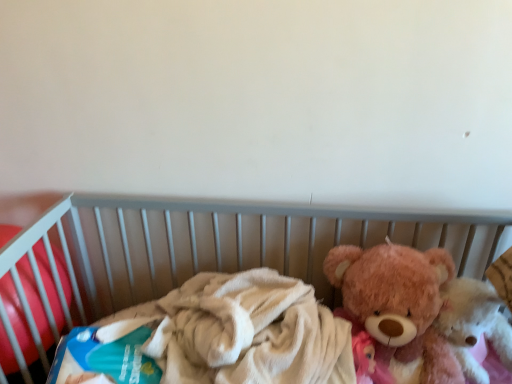
Question: Is soft plush bear at right closer to camera compared to blue cardboard box at left?

Choices:
 (A) yes
 (B) no

Answer: (A)

Question: From the image's perspective, would you say soft plush bear at right is shown under blue cardboard box at left?

Choices:
 (A) no
 (B) yes

Answer: (B)

Question: Is soft plush bear at right behind blue cardboard box at left?

Choices:
 (A) yes
 (B) no

Answer: (B)

Question: From a real-world perspective, is soft plush bear at right under blue cardboard box at left?

Choices:
 (A) no
 (B) yes

Answer: (B)

Question: From the image's perspective, would you say soft plush bear at right is positioned over blue cardboard box at left?

Choices:
 (A) no
 (B) yes

Answer: (A)

Question: From a real-world perspective, is blue cardboard box at left positioned above or below fluffy pink teddy bear at right, which ranks as the second teddy bear in left-to-right order?

Choices:
 (A) above
 (B) below

Answer: (A)

Question: Is blue cardboard box at left inside or outside of fluffy pink teddy bear at right, which is counted as the first teddy bear, starting from the right?

Choices:
 (A) inside
 (B) outside

Answer: (B)

Question: Does point tap(15, 307) appear closer or farther from the camera than point tap(496, 319)?

Choices:
 (A) farther
 (B) closer

Answer: (B)

Question: Based on their sizes in the image, would you say blue cardboard box at left is bigger or smaller than fluffy pink teddy bear at right, which ranks as the second teddy bear in left-to-right order?

Choices:
 (A) small
 (B) big

Answer: (B)

Question: Considering their positions, is fluffy pink teddy bear at right, acting as the 2th teddy bear starting from the right, located in front of or behind soft plush bear at right?

Choices:
 (A) behind
 (B) front

Answer: (A)

Question: From the image's perspective, is fluffy pink teddy bear at right, the 1th teddy bear when ordered from left to right, positioned above or below soft plush bear at right?

Choices:
 (A) above
 (B) below

Answer: (A)

Question: Does point (449, 375) appear closer or farther from the camera than point (84, 221)?

Choices:
 (A) closer
 (B) farther

Answer: (A)

Question: Is fluffy pink teddy bear at right, the 1th teddy bear when ordered from left to right, inside the boundaries of soft plush bear at right, or outside?

Choices:
 (A) outside
 (B) inside

Answer: (B)

Question: From a real-world perspective, is soft plush bear at right physically located above or below fluffy pink teddy bear at right, the 1th teddy bear when ordered from left to right?

Choices:
 (A) above
 (B) below

Answer: (B)

Question: Considering the relative positions of soft plush bear at right and fluffy pink teddy bear at right, the 1th teddy bear when ordered from left to right, in the image provided, is soft plush bear at right to the left or to the right of fluffy pink teddy bear at right, the 1th teddy bear when ordered from left to right,?

Choices:
 (A) left
 (B) right

Answer: (A)